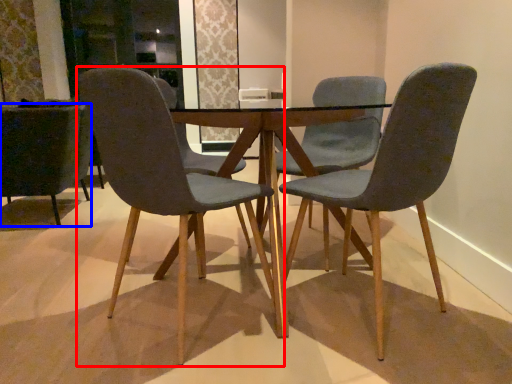
Question: Which point is further to the camera, chair (highlighted by a red box) or chair (highlighted by a blue box)?

Choices:
 (A) chair
 (B) chair

Answer: (B)